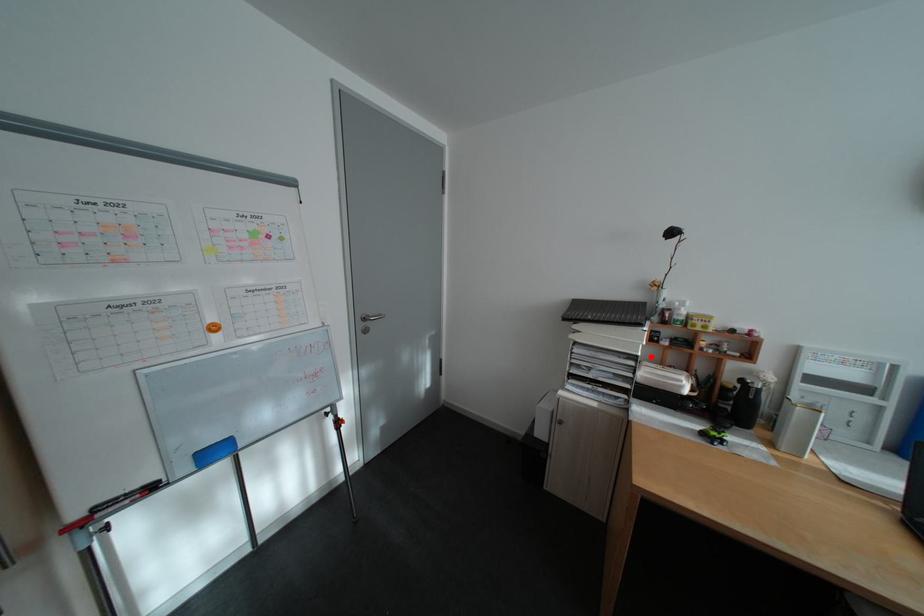
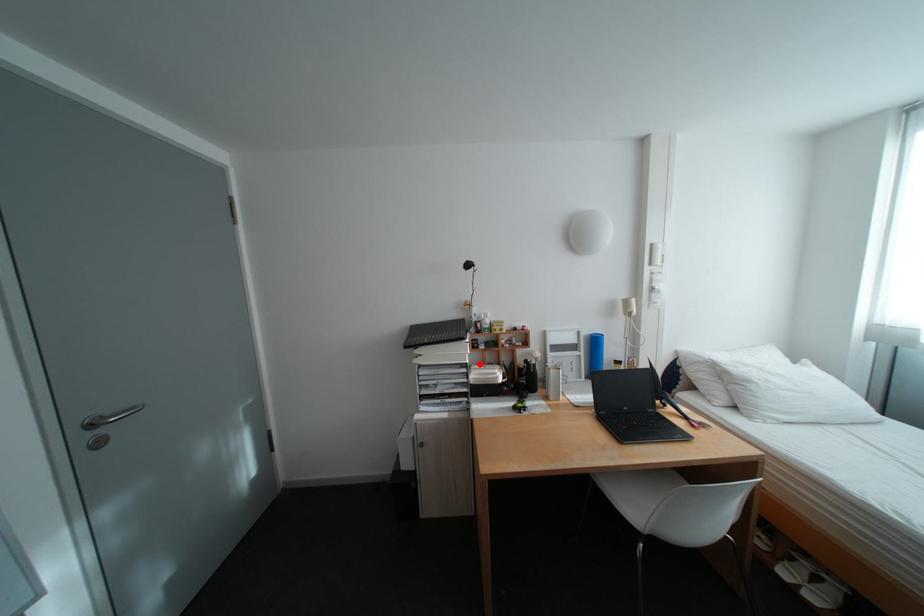
I am providing you with two images of the same scene from different viewpoints. A red point is marked on the first image and another point is marked on the second image. Is the red point in image1 aligned with the point shown in image2?

Yes